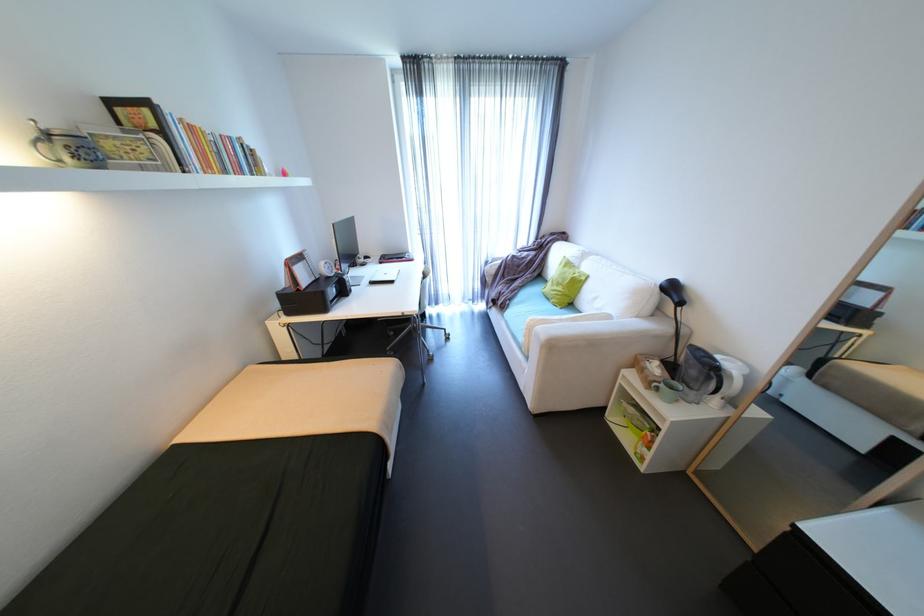
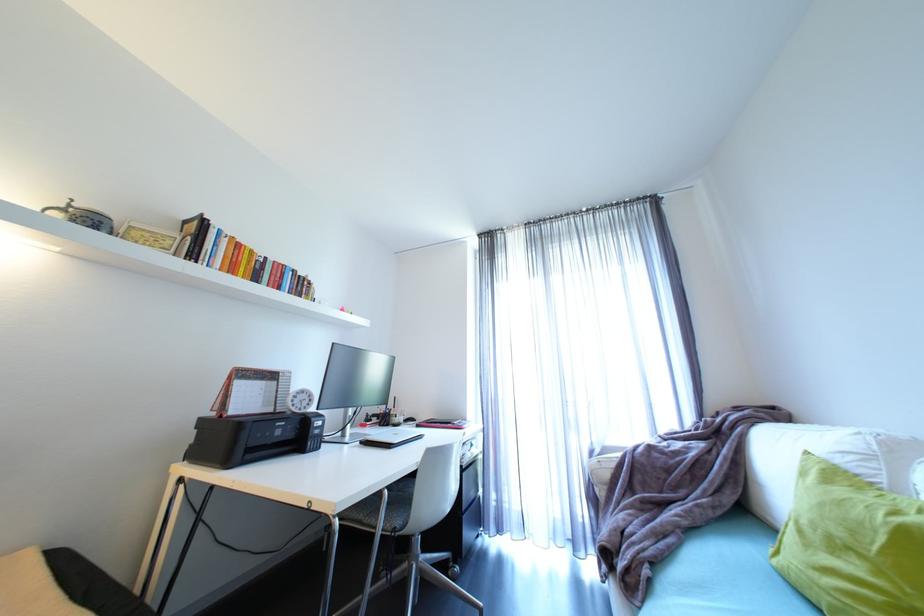
The point at (337, 269) is marked in the first image. Where is the corresponding point in the second image?

(312, 402)